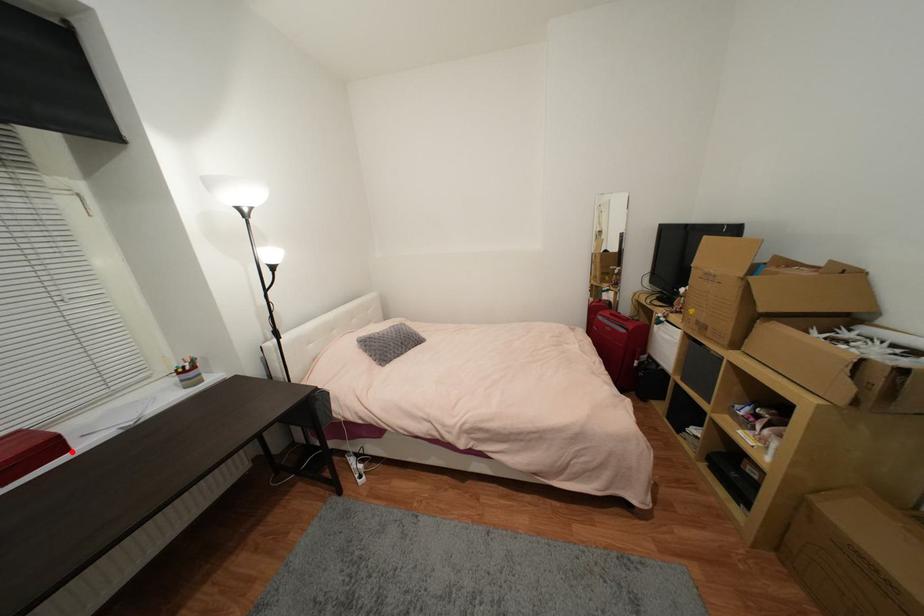
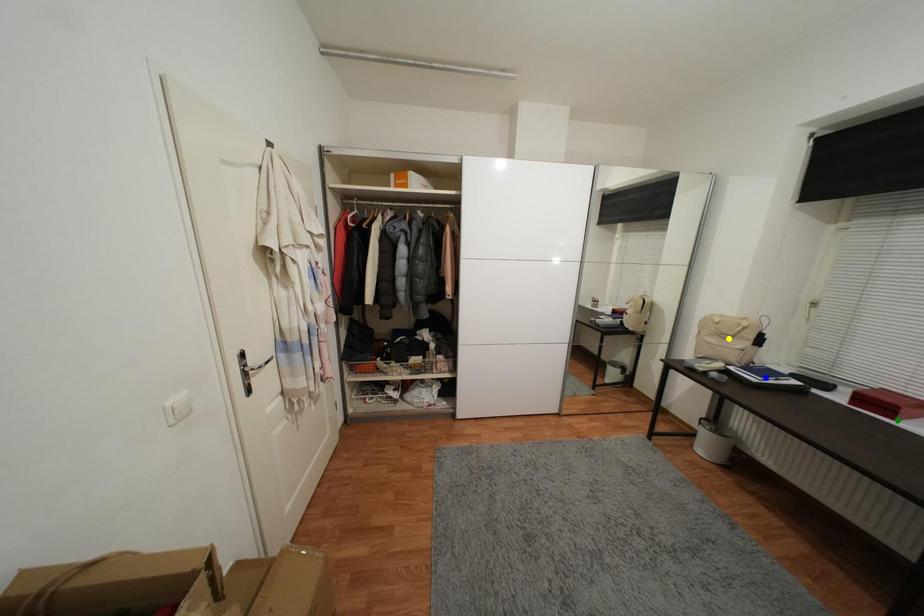
Question: I am providing you with two images of the same scene from different viewpoints. A red point is marked on the first image. You are given multiple points on the second image. Which spot in image 2 lines up with the point in image 1?

Choices:
 (A) green point
 (B) blue point
 (C) yellow point

Answer: (A)